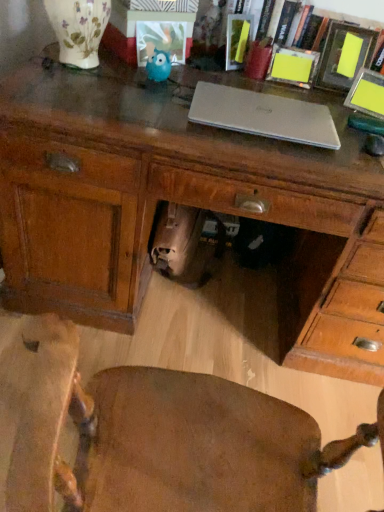
Image resolution: width=384 pixels, height=512 pixels. I want to click on vacant area that is in front of matte yellow book at upper center, marked as the first book in a left-to-right arrangement, so click(x=225, y=77).